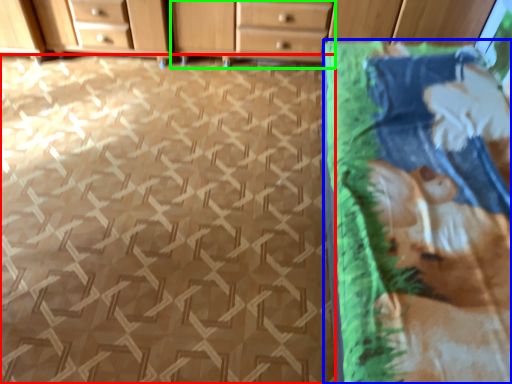
Question: Considering the real-world distances, which object is farthest from tile (highlighted by a red box)? blanket (highlighted by a blue box) or chest of drawers (highlighted by a green box)?

Choices:
 (A) blanket
 (B) chest of drawers

Answer: (B)